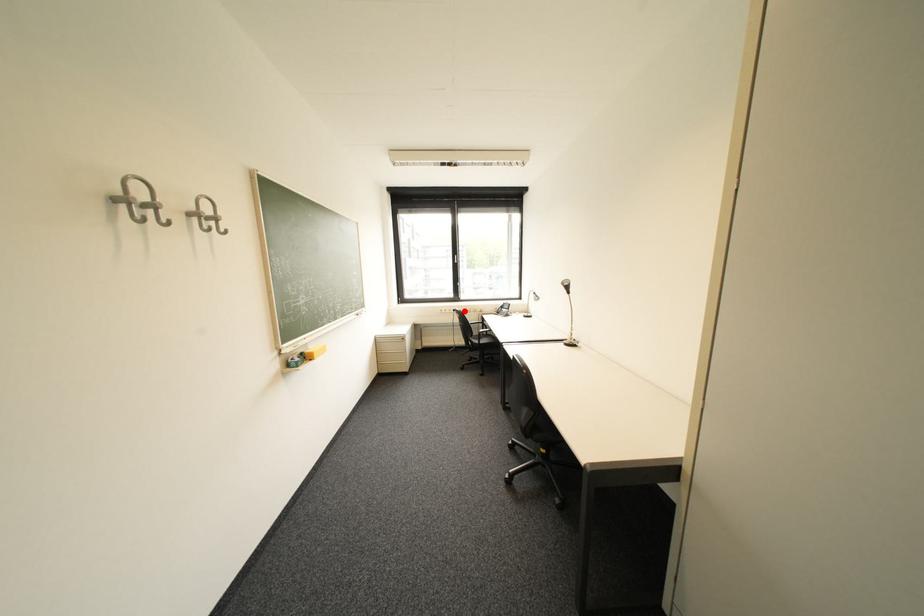
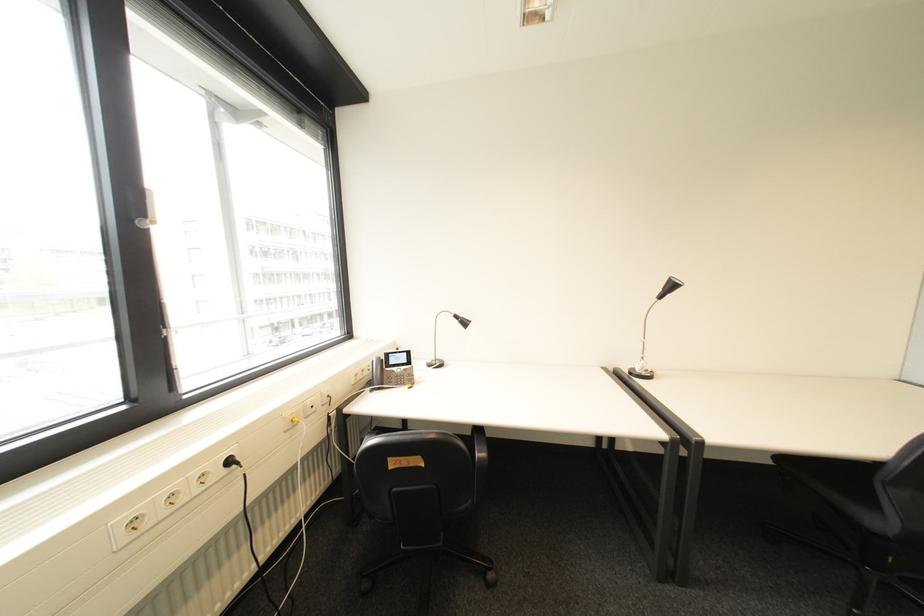
The point at the highlighted location is marked in the first image. Where is the corresponding point in the second image?

(239, 463)